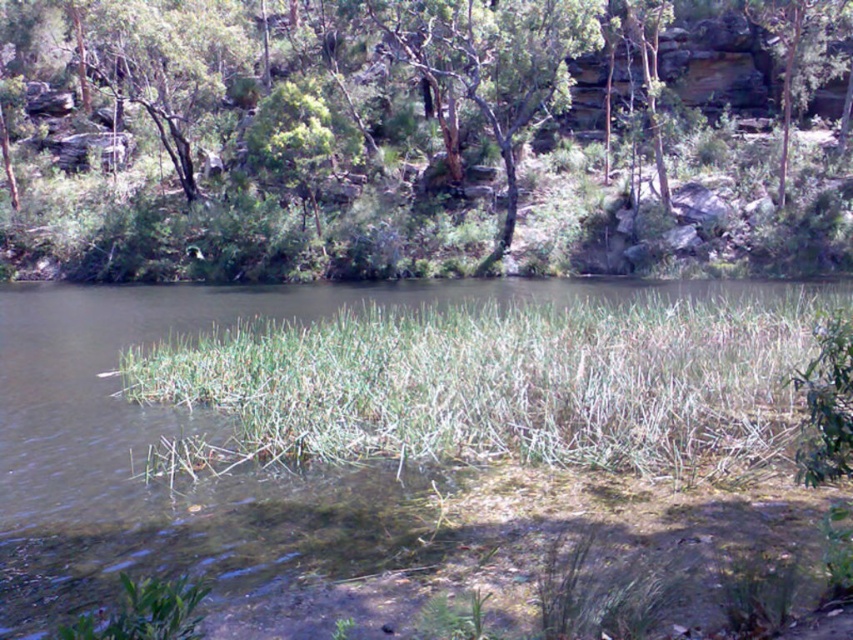
Question: Which object is closer to the camera taking this photo?

Choices:
 (A) green fibrous grass at center
 (B) green leafy tree at upper center

Answer: (A)

Question: Is green fibrous grass at center thinner than green leafy tree at upper right?

Choices:
 (A) yes
 (B) no

Answer: (B)

Question: Is green leafy tree at upper center behind green leafy tree at upper right?

Choices:
 (A) yes
 (B) no

Answer: (B)

Question: Which object is farther from the camera taking this photo?

Choices:
 (A) green fibrous grass at center
 (B) green leafy tree at upper center
 (C) green leafy tree at upper right

Answer: (C)

Question: Which object appears farthest from the camera in this image?

Choices:
 (A) green leafy tree at upper center
 (B) green leafy tree at upper right

Answer: (B)

Question: Observing the image, what is the correct spatial positioning of green leafy tree at upper center in reference to green fibrous grass at center?

Choices:
 (A) below
 (B) above

Answer: (B)